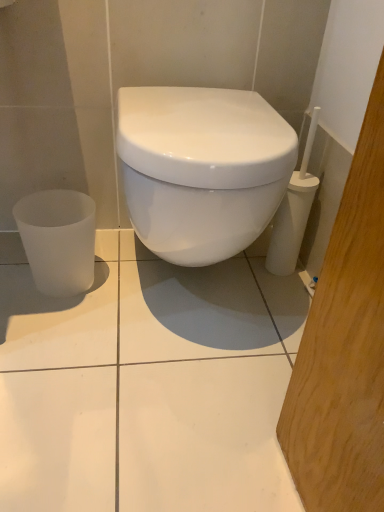
Question: From the image's perspective, is white glossy toilet at center above or below frosted glass cup at lower left?

Choices:
 (A) above
 (B) below

Answer: (A)

Question: From a real-world perspective, is white glossy toilet at center positioned above or below frosted glass cup at lower left?

Choices:
 (A) above
 (B) below

Answer: (A)

Question: In the image, is white glossy toilet at center positioned in front of or behind frosted glass cup at lower left?

Choices:
 (A) behind
 (B) front

Answer: (B)

Question: Does point (36, 254) appear closer or farther from the camera than point (251, 147)?

Choices:
 (A) closer
 (B) farther

Answer: (B)

Question: Considering the positions of frosted glass cup at lower left and white glossy toilet at center in the image, is frosted glass cup at lower left wider or thinner than white glossy toilet at center?

Choices:
 (A) thin
 (B) wide

Answer: (A)

Question: From their relative heights in the image, would you say frosted glass cup at lower left is taller or shorter than white glossy toilet at center?

Choices:
 (A) tall
 (B) short

Answer: (B)

Question: From a real-world perspective, is frosted glass cup at lower left positioned above or below white glossy toilet at center?

Choices:
 (A) below
 (B) above

Answer: (A)